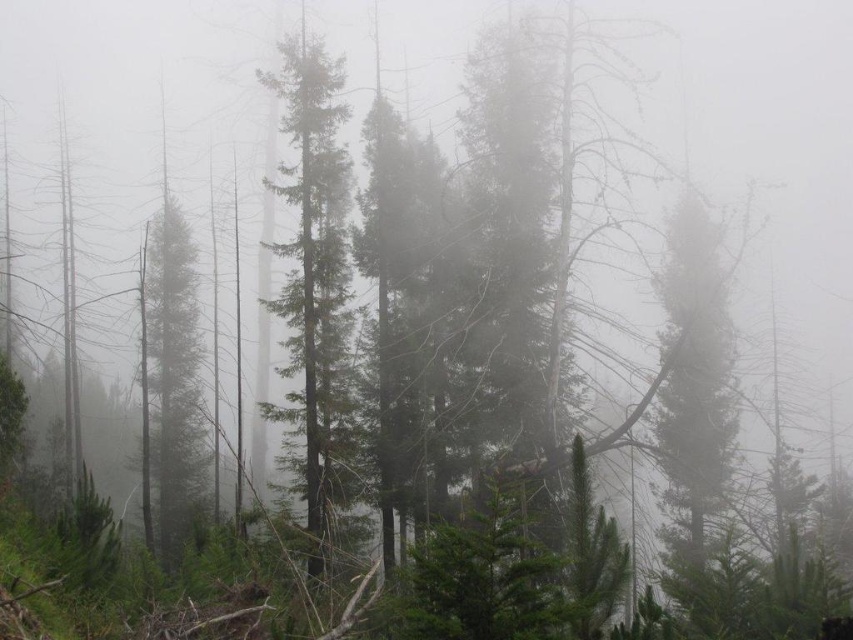
Question: Is green textured tree at right thinner than green textured tree at center?

Choices:
 (A) yes
 (B) no

Answer: (A)

Question: Can you confirm if green textured tree at right is wider than green textured tree at center?

Choices:
 (A) yes
 (B) no

Answer: (B)

Question: Among these points, which one is nearest to the camera?

Choices:
 (A) (706, 250)
 (B) (341, 74)

Answer: (B)

Question: Is green textured tree at right below green textured tree at center?

Choices:
 (A) no
 (B) yes

Answer: (B)